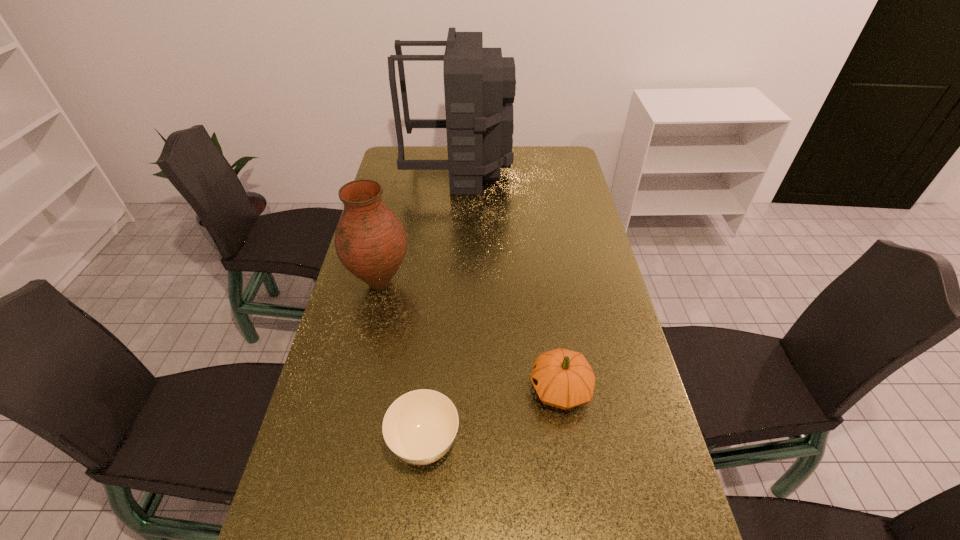
What are the coordinates of `the tallest object` in the screenshot? It's located at (479, 84).

Where is `backpack`? The width and height of the screenshot is (960, 540). backpack is located at coordinates [x=479, y=84].

The height and width of the screenshot is (540, 960). In order to click on the second tallest object in this screenshot , I will do `click(370, 241)`.

Where is `the second farthest object`? the second farthest object is located at coordinates pyautogui.click(x=370, y=241).

At what (x,y) coordinates should I click in order to perform the action: click on the third tallest object. Please return your answer as a coordinate pair (x, y). This screenshot has width=960, height=540. Looking at the image, I should click on (562, 378).

Locate an element on the screen. The width and height of the screenshot is (960, 540). the shortest object is located at coordinates pyautogui.click(x=419, y=427).

Locate an element on the screen. blank area located on the front compartment of the farthest object is located at coordinates (537, 170).

The height and width of the screenshot is (540, 960). What are the coordinates of `free space located 0.290m on the front of the vase` in the screenshot? It's located at (355, 393).

Find the location of `vacant space located 0.370m on the side of the third tallest object with the carved face`. vacant space located 0.370m on the side of the third tallest object with the carved face is located at coordinates (382, 389).

In order to click on blank space located on the side of the third tallest object with the carved face in this screenshot , I will do `click(397, 389)`.